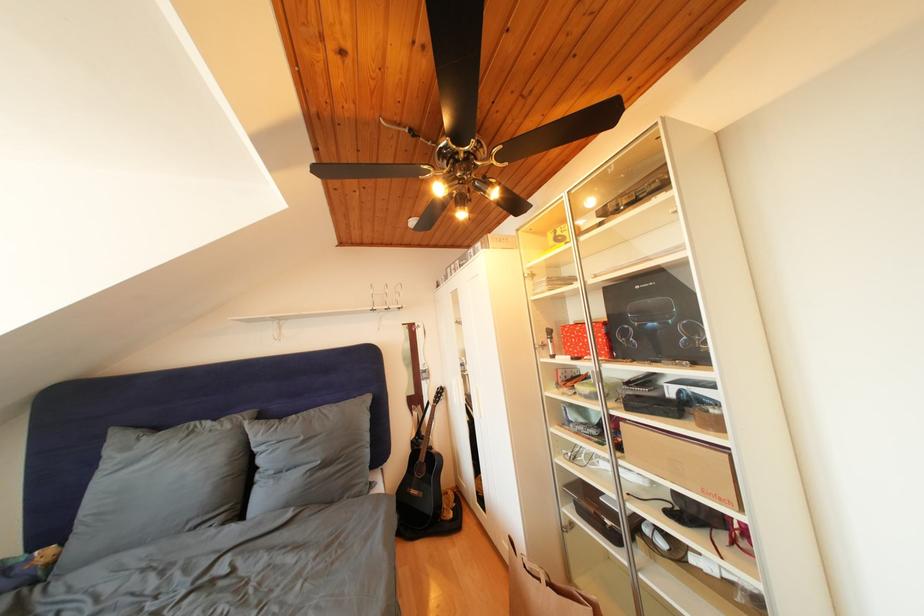
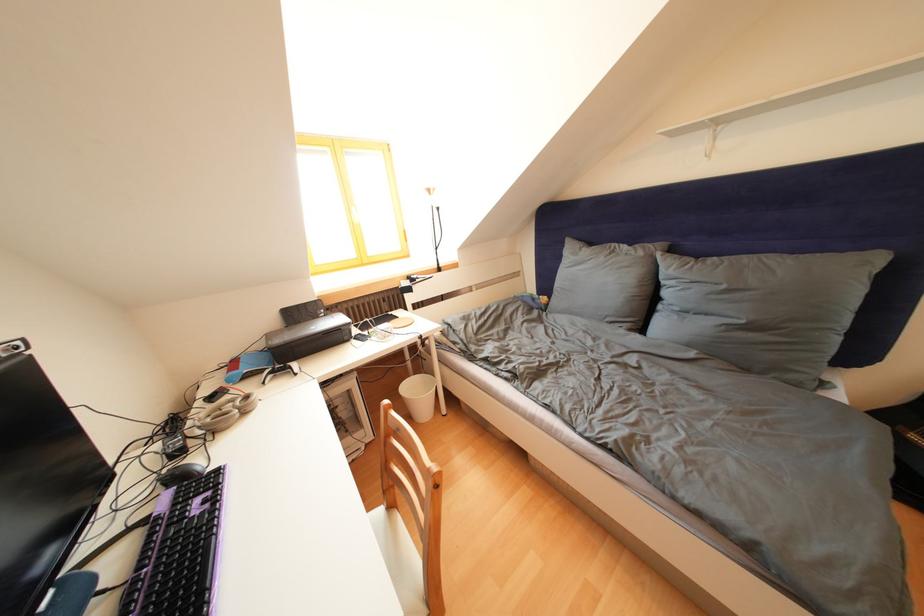
Locate, in the second image, the point that corresponds to (x=310, y=444) in the first image.

(733, 292)